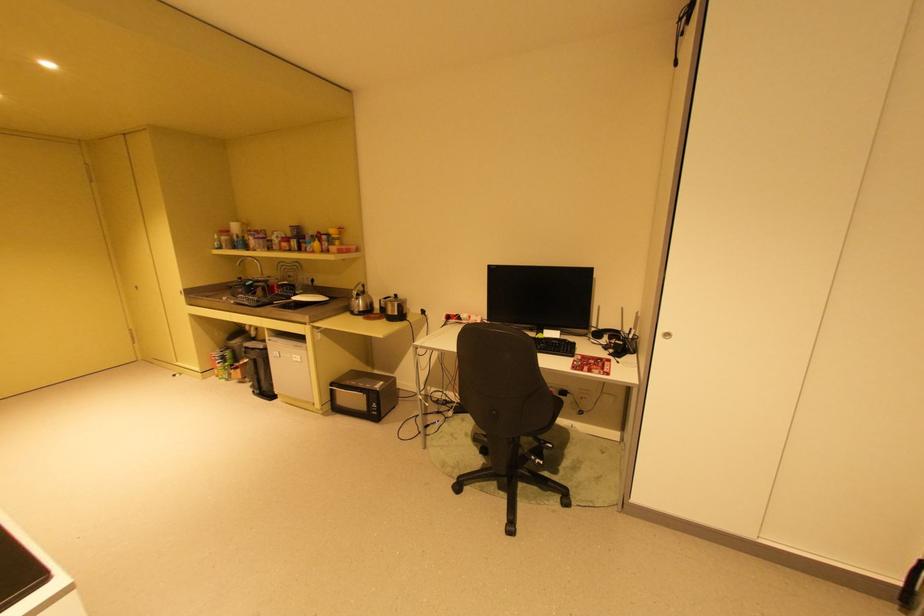
Describe the element at coordinates (397, 310) in the screenshot. This screenshot has width=924, height=616. I see `a black pot handle` at that location.